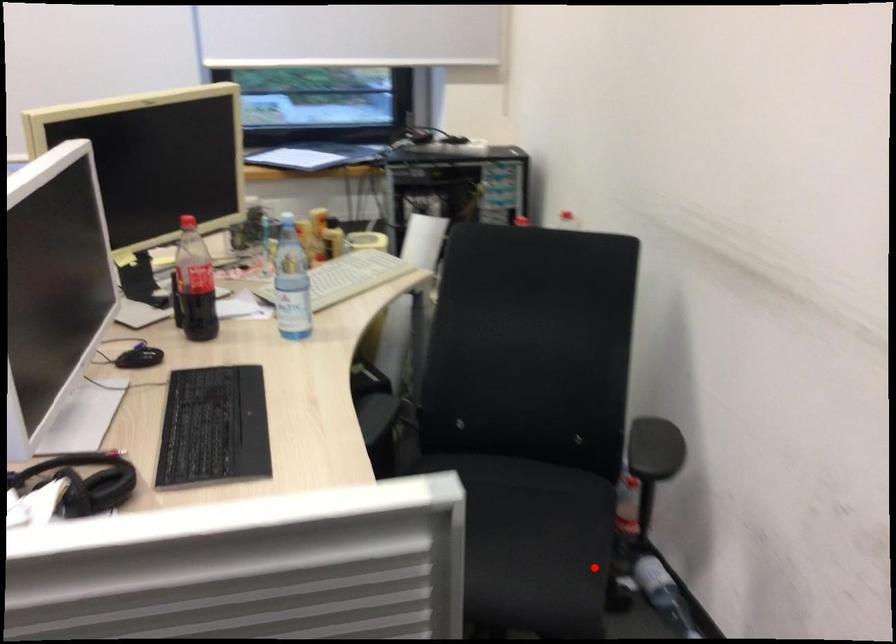
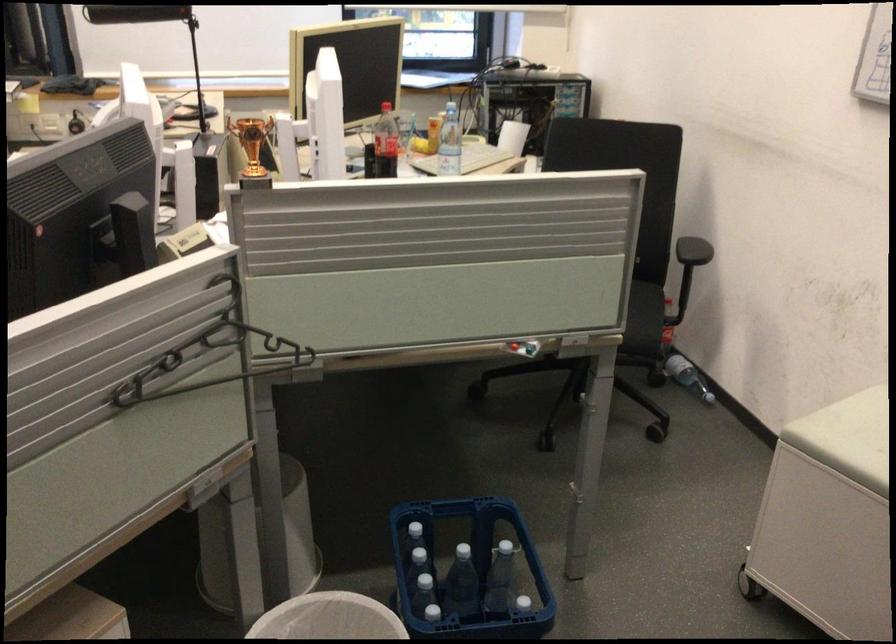
Question: I am providing you with two images of the same scene from different viewpoints. Image1 has a red point marked. In image2, the corresponding 3D location appears at what relative position? Reply with the corresponding letter.

Choices:
 (A) Closer
 (B) Farther

Answer: (B)